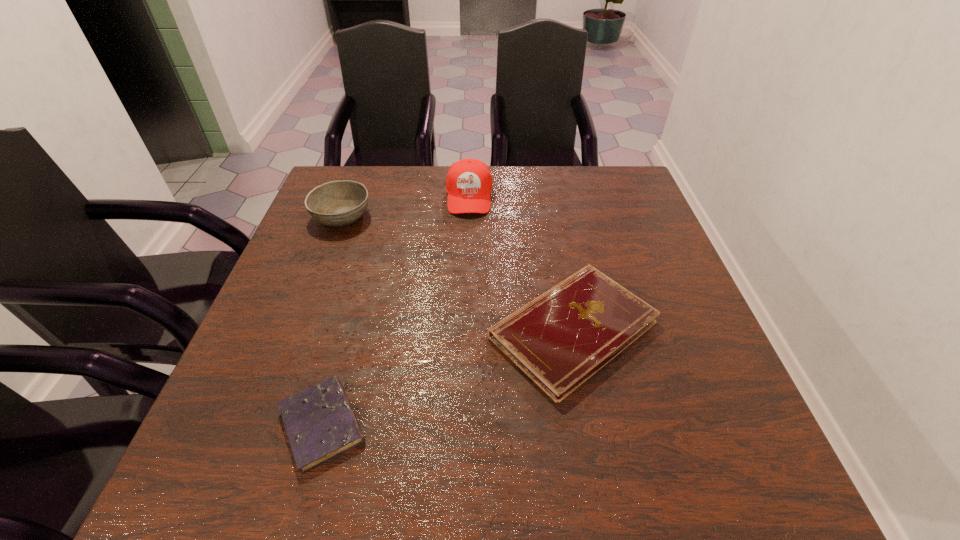
The width and height of the screenshot is (960, 540). Find the location of `vacant area that lies between the tallest object and the diary`. vacant area that lies between the tallest object and the diary is located at coordinates (396, 310).

The image size is (960, 540). I want to click on vacant point located between the tallest object and the second shortest object, so click(521, 263).

At what (x,y) coordinates should I click in order to perform the action: click on vacant region between the shortest object and the notebook. Please return your answer as a coordinate pair (x, y). Image resolution: width=960 pixels, height=540 pixels. Looking at the image, I should click on (447, 377).

Find the location of `free spot between the shortest object and the bowl`. free spot between the shortest object and the bowl is located at coordinates (332, 320).

In order to click on object that is the second closest to the bowl in this screenshot , I will do `click(560, 339)`.

Locate which object is the closest to the third tallest object. Please provide its 2D coordinates. Your answer should be formatted as a tuple, i.e. [(x, y)], where the tuple contains the x and y coordinates of a point satisfying the conditions above.

[(320, 423)]

Identify the location of free spot that satisfies the following two spatial constraints: 1. on the front panel of the notebook; 2. on the left side of the tallest object. 465,329.

The image size is (960, 540). What are the coordinates of `vacant space that satisfies the following two spatial constraints: 1. on the front panel of the baseball cap; 2. on the right side of the notebook` in the screenshot? It's located at (465, 329).

Find the location of a particular element. The width and height of the screenshot is (960, 540). vacant area that satisfies the following two spatial constraints: 1. on the front panel of the tallest object; 2. on the right side of the third tallest object is located at coordinates (465, 329).

Locate an element on the screen. The height and width of the screenshot is (540, 960). vacant area in the image that satisfies the following two spatial constraints: 1. on the front side of the bowl; 2. on the left side of the diary is located at coordinates (263, 424).